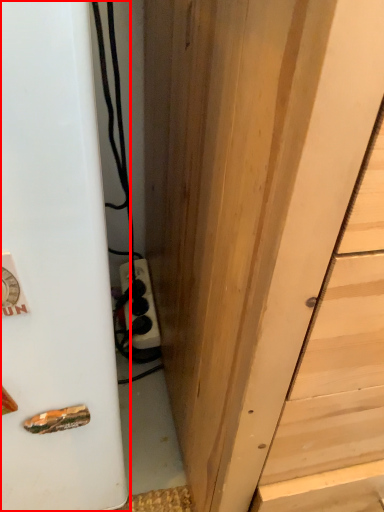
Question: From the image's perspective, what is the correct spatial relationship of appliance (annotated by the red box) in relation to door?

Choices:
 (A) above
 (B) below

Answer: (B)